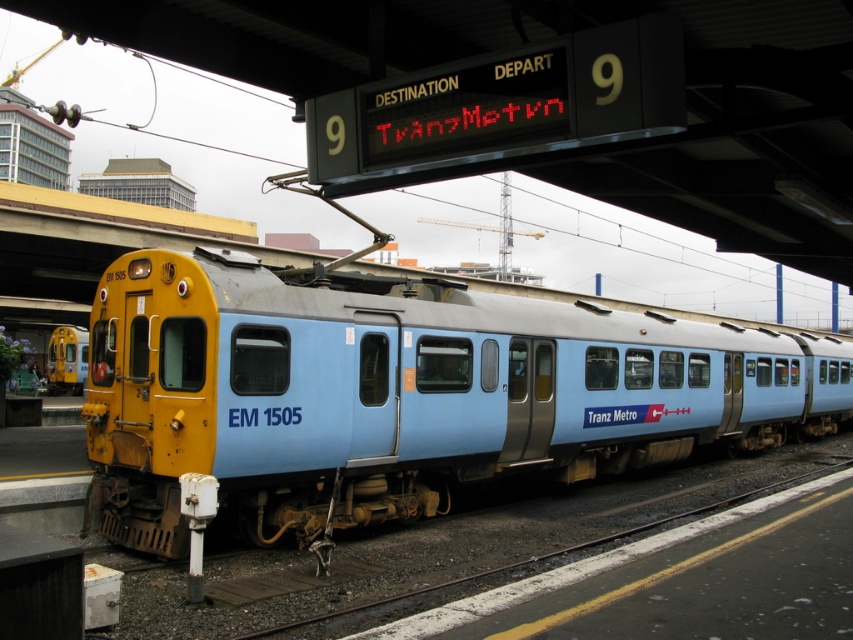
You are standing on the platform at the train station. You see the matte blue train at center. If you want to board the train, which is 7.82 meters away from you, but you have a wheelchair that requires a 1.2 meter clearance for safe movement. Is the distance sufficient for you to safely move your wheelchair towards the train?

The distance between you and the matte blue train at center is 7.82 meters, which is more than enough clearance for a wheelchair requiring 1.2 meters. You can safely move your wheelchair towards the matte blue train at center.

You are standing on platform 9 at the station and see two points marked on the platform floor. The first point is labeled as point (126, 364) and the second is point (85, 337). Which point is closer to you?

Point (126, 364) is closer to the viewer than point (85, 337).

You are a passenger at platform 9 and need to board the matte blue train at center. Where should you stand to board the train?

The matte blue train at center is located at coordinates point [402,394], so you should stand at that position to board the train.